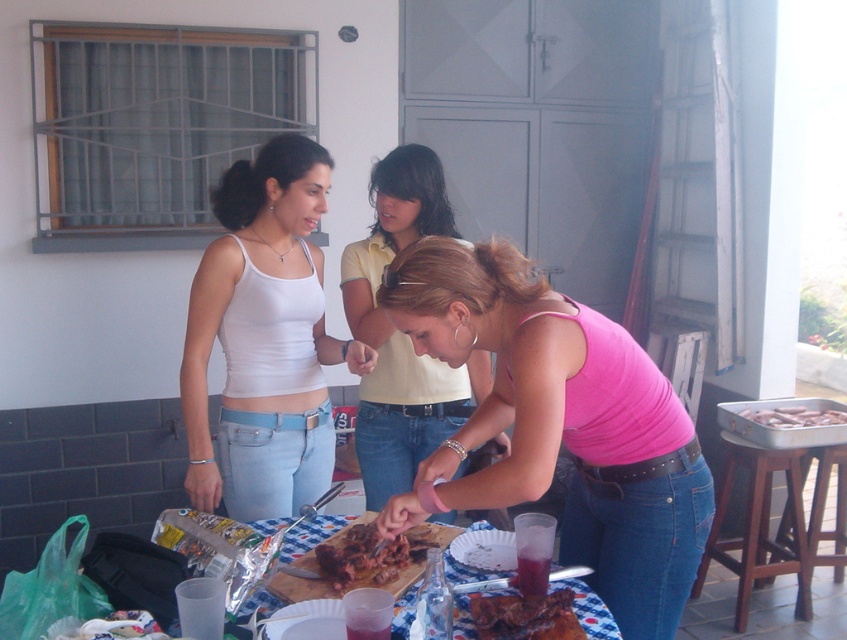
Question: Which object is the farthest from the white matte tank top at center?

Choices:
 (A) pink fabric shirt at center
 (B) brown crispy meat at center

Answer: (B)

Question: Which point is farther from the camera taking this photo?

Choices:
 (A) (x=817, y=410)
 (B) (x=230, y=243)

Answer: (A)

Question: Does white matte tank top at center come in front of pink fabric shirt at center?

Choices:
 (A) yes
 (B) no

Answer: (A)

Question: Considering the relative positions of pink matte tank top at center and brown crispy meat at center in the image provided, where is pink matte tank top at center located with respect to brown crispy meat at center?

Choices:
 (A) below
 (B) above

Answer: (B)

Question: Does pink matte tank top at center appear under brown crispy meat at center?

Choices:
 (A) yes
 (B) no

Answer: (B)

Question: Which point is closer to the camera taking this photo?

Choices:
 (A) (289, 218)
 (B) (446, 420)

Answer: (A)